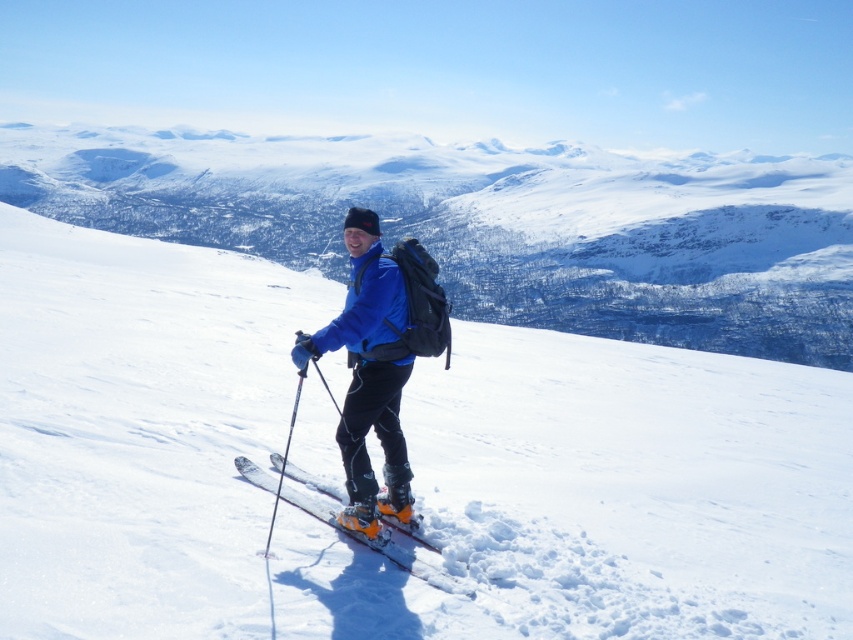
Question: Does white snow mountain at center appear over orange matte skis at center?

Choices:
 (A) yes
 (B) no

Answer: (A)

Question: Is white snow mountain at center to the left of matte black ski pole at center from the viewer's perspective?

Choices:
 (A) no
 (B) yes

Answer: (B)

Question: Among these objects, which one is nearest to the camera?

Choices:
 (A) white powder snow at center
 (B) orange matte skis at center
 (C) blue matte jacket at center

Answer: (A)

Question: Considering the real-world distances, which object is closest to the white powder snow at center?

Choices:
 (A) white snow mountain at center
 (B) blue matte jacket at center
 (C) orange matte skis at center
 (D) matte black ski pole at center

Answer: (D)

Question: Which point is closer to the camera taking this photo?

Choices:
 (A) (726, 520)
 (B) (303, 360)
 (C) (251, 470)
 (D) (641, 337)

Answer: (B)

Question: Is white snow mountain at center positioned at the back of matte black ski pole at center?

Choices:
 (A) yes
 (B) no

Answer: (A)